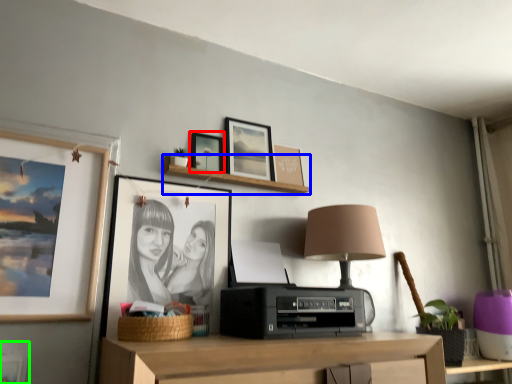
Question: Estimate the real-world distances between objects in this image. Which object is closer to picture frame (highlighted by a red box), shelf (highlighted by a blue box) or picture frame (highlighted by a green box)?

Choices:
 (A) shelf
 (B) picture frame

Answer: (A)